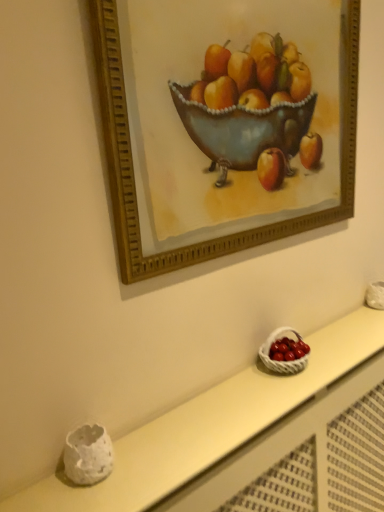
Locate an element on the screen. vacant position to the left of white wicker basket at lower right is located at coordinates (232, 387).